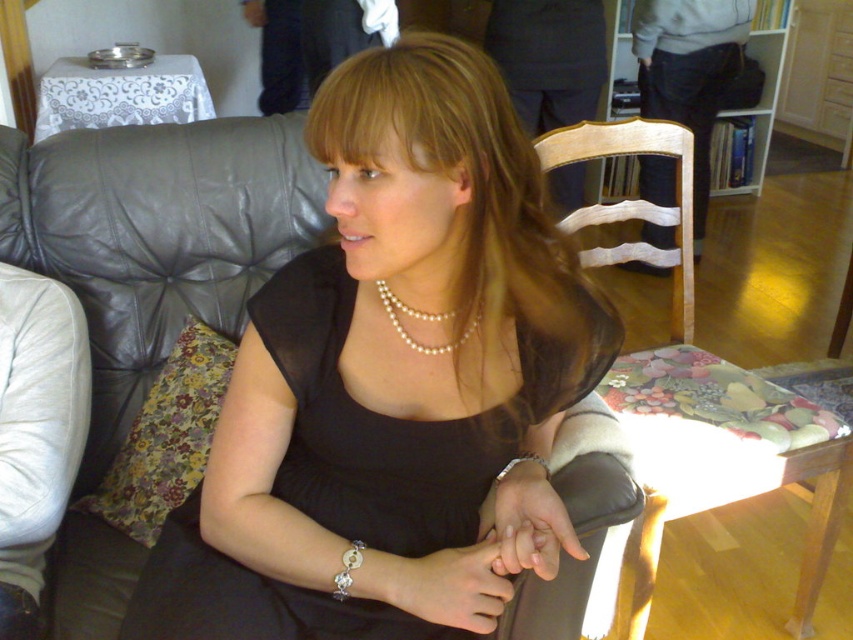
Question: Is the position of black sheer dress at center more distant than that of dark gray suit jacket at upper center?

Choices:
 (A) no
 (B) yes

Answer: (A)

Question: Is black sheer dress at center positioned at the back of silver metallic bracelet at lower center?

Choices:
 (A) no
 (B) yes

Answer: (A)

Question: Can you confirm if pearl necklace at center is wider than silver metallic bracelet at lower center?

Choices:
 (A) yes
 (B) no

Answer: (A)

Question: Which object appears closest to the camera in this image?

Choices:
 (A) smooth skin hand at lower center
 (B) silver metallic bracelet at wrist
 (C) smooth skin hand at center
 (D) dark gray suit jacket at upper center

Answer: (C)

Question: Considering the real-world distances, which object is closest to the black sheer dress at center?

Choices:
 (A) smooth skin hand at lower center
 (B) smooth skin hand at center

Answer: (A)

Question: Among these points, which one is nearest to the camera?

Choices:
 (A) (393, 19)
 (B) (285, 273)

Answer: (B)